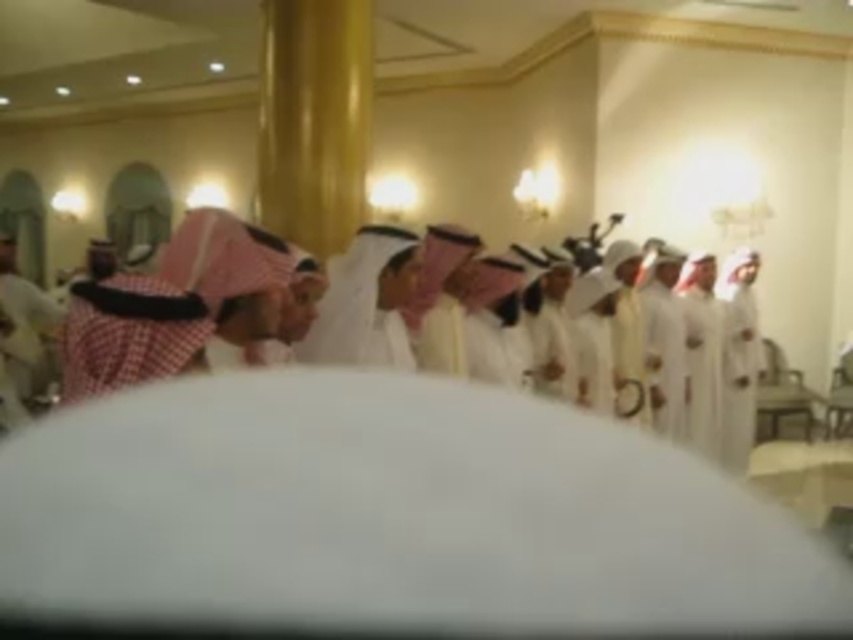
You are standing in the banquet hall and want to take a photo. There are two points marked in the scene, point A at coordinates point (724, 339) and point B at coordinates point (706, 289). Which point is closer to your camera?

Point point (724, 339) is closer to the camera than point point (706, 289), so you should focus on point A for a clearer photo.

Based on the coordinates provided, which object corresponds to the point at (740,374) in the scene?

The point at (740,374) corresponds to the white cotton robe at right.